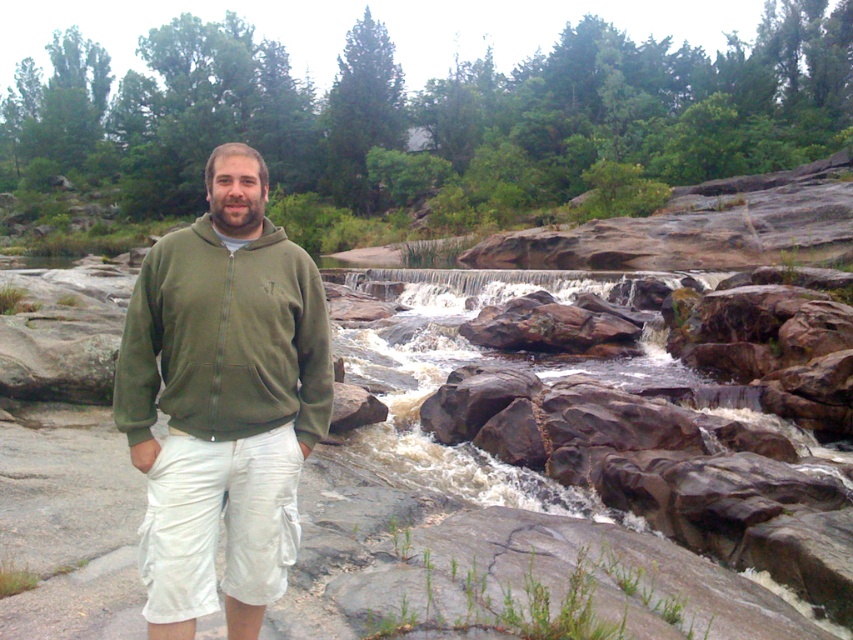
Looking at this image, you are a hiker planning to cross the rocky riverbed. You see the green fleece jacket at center and the olive green fleece sweatshirt at left. Which clothing item is positioned lower in the scene?

The green fleece jacket at center is located below the olive green fleece sweatshirt at left, so it is positioned lower in the scene.

You are a hiker who wants to place a small backpack on the ground near the green fleece jacket at center. Based on the scene description, can you determine the exact coordinates where you should place the backpack?

The green fleece jacket at center is located at coordinates [223,401]. Therefore, the backpack should be placed near these coordinates.

You are a hiker planning to cross the rocky riverbed. You see the green fleece jacket at center and the olive green fleece sweatshirt at left. Which clothing item is taller and would provide better visibility in this rugged terrain?

The green fleece jacket at center is much taller than the olive green fleece sweatshirt at left, so it would provide better visibility in the rugged terrain.